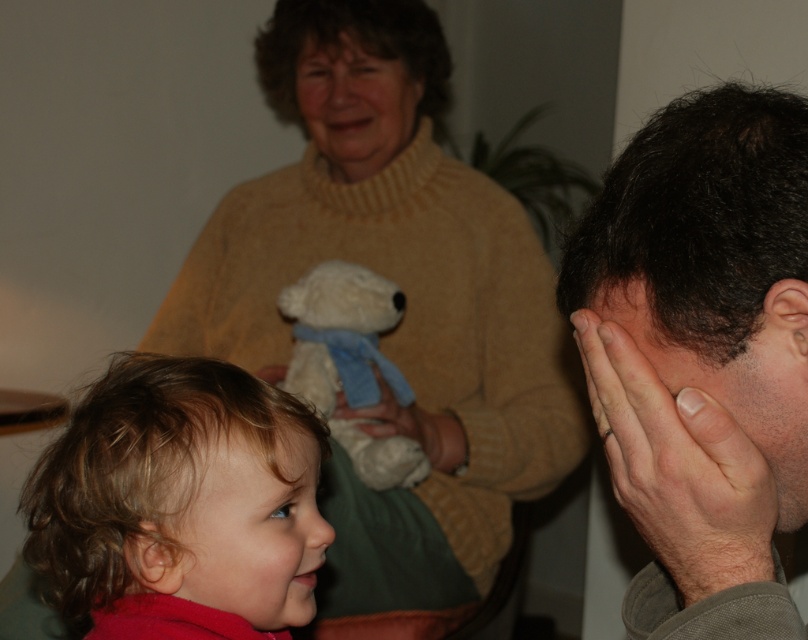
Question: Based on their relative distances, which object is farther from the smooth beige sweater at upper center?

Choices:
 (A) beige knitted sweater at upper center
 (B) smooth skin nose at upper center
 (C) smooth skin hands at right
 (D) dark brown hair at right

Answer: (C)

Question: Is smooth red face at lower left above smooth skin nose at lower left?

Choices:
 (A) yes
 (B) no

Answer: (B)

Question: Which object is the closest to the smooth skin nose at upper center?

Choices:
 (A) curly blonde hair at lower left
 (B) knitted yellow sweater at upper center

Answer: (B)

Question: Observing the image, what is the correct spatial positioning of curly blonde hair at lower left in reference to white plush bear at center?

Choices:
 (A) right
 (B) left

Answer: (B)

Question: Considering the real-world distances, which object is farthest from the smooth skin nose at lower left?

Choices:
 (A) skinny brown hair at upper right
 (B) curly blonde hair at lower left
 (C) white plush bear at center
 (D) smooth beige sweater at upper center

Answer: (D)

Question: Does blonde hair at lower left have a greater width compared to skinny brown hair at upper right?

Choices:
 (A) no
 (B) yes

Answer: (B)